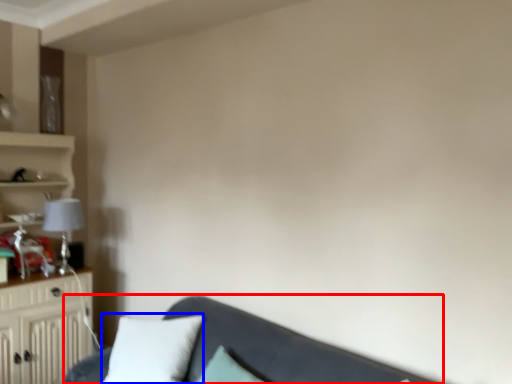
Question: Which point is further to the camera, studio couch (highlighted by a red box) or pillow (highlighted by a blue box)?

Choices:
 (A) studio couch
 (B) pillow

Answer: (B)